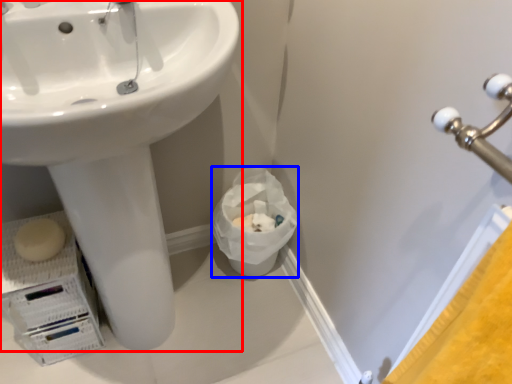
Question: Which object is further to the camera taking this photo, sink (highlighted by a red box) or garbage (highlighted by a blue box)?

Choices:
 (A) sink
 (B) garbage

Answer: (B)